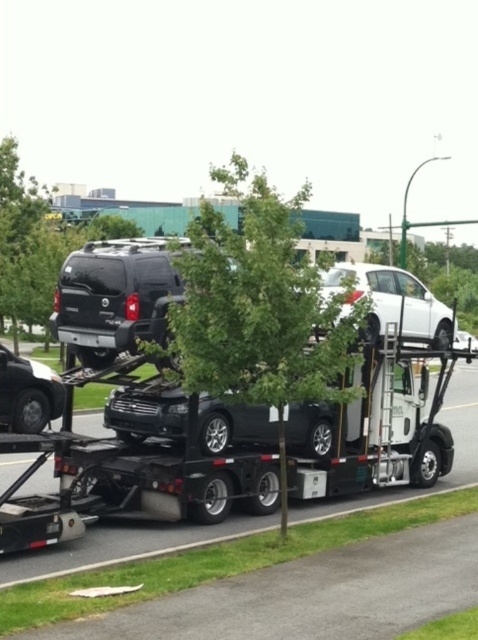
Question: Which is nearer to the matte black suv at center?

Choices:
 (A) green leafy tree at center
 (B) shiny black sedan at left
 (C) white matte car at center

Answer: (B)

Question: Which object is positioned farthest from the green leafy tree at center?

Choices:
 (A) matte black suv at center
 (B) green leafy tree at upper left
 (C) glossy black car carrier at center

Answer: (B)

Question: Does matte black suv at center appear under shiny black sedan at left?

Choices:
 (A) no
 (B) yes

Answer: (A)

Question: Does glossy black car carrier at center have a greater width compared to green leafy tree at upper left?

Choices:
 (A) no
 (B) yes

Answer: (A)

Question: Which point is closer to the camera?

Choices:
 (A) (178, 440)
 (B) (185, 237)
 (C) (413, 333)

Answer: (A)

Question: Can you confirm if glossy black car carrier at center is positioned to the right of white matte car at center?

Choices:
 (A) yes
 (B) no

Answer: (B)